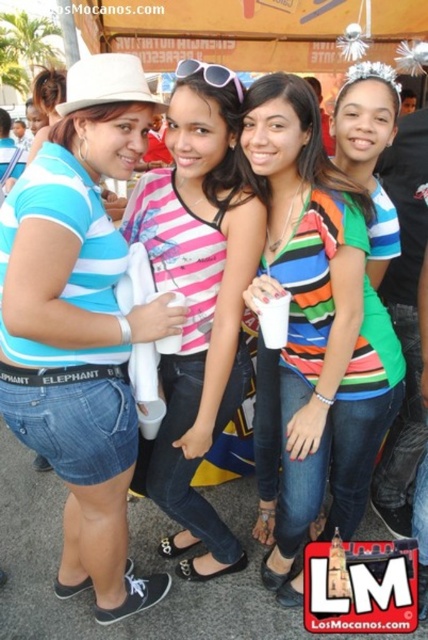
Question: Which point is closer to the camera taking this photo?

Choices:
 (A) (235, 90)
 (B) (65, 516)
 (C) (186, 328)

Answer: (A)

Question: Is pink striped shirt at center above pink plastic sunglasses at center?

Choices:
 (A) no
 (B) yes

Answer: (A)

Question: Which object is closer to the camera taking this photo?

Choices:
 (A) pink plastic sunglasses at center
 (B) blue striped shirt at center

Answer: (B)

Question: Based on their relative distances, which object is farther from the pink striped shirt at center?

Choices:
 (A) blue striped shirt at center
 (B) pink plastic sunglasses at center

Answer: (B)

Question: Is blue striped shirt at center above pink striped shirt at center?

Choices:
 (A) no
 (B) yes

Answer: (A)

Question: Can you confirm if pink striped shirt at center is thinner than pink plastic sunglasses at center?

Choices:
 (A) no
 (B) yes

Answer: (A)